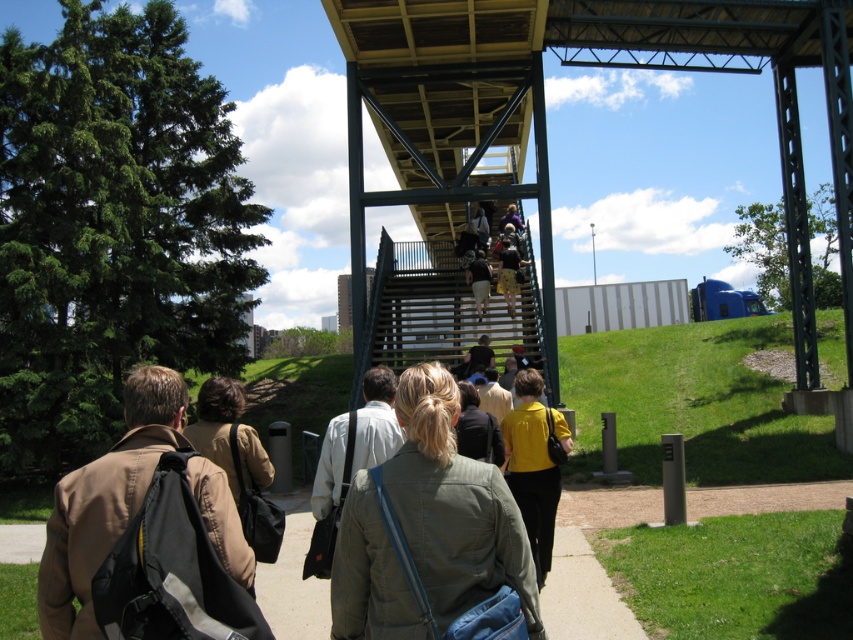
Is brown leather jacket at lower left smaller than yellow matte shirt at center?

Yes.

This screenshot has width=853, height=640. Describe the element at coordinates (103, 502) in the screenshot. I see `brown leather jacket at lower left` at that location.

The height and width of the screenshot is (640, 853). In order to click on brown leather jacket at lower left in this screenshot , I will do `click(103, 502)`.